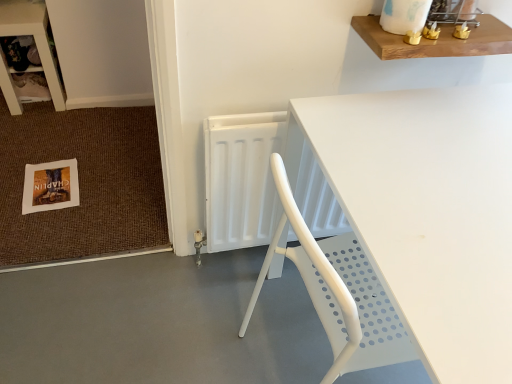
The width and height of the screenshot is (512, 384). What are the coordinates of `vacant space to the left of white paper postcard at lower left` in the screenshot? It's located at (13, 172).